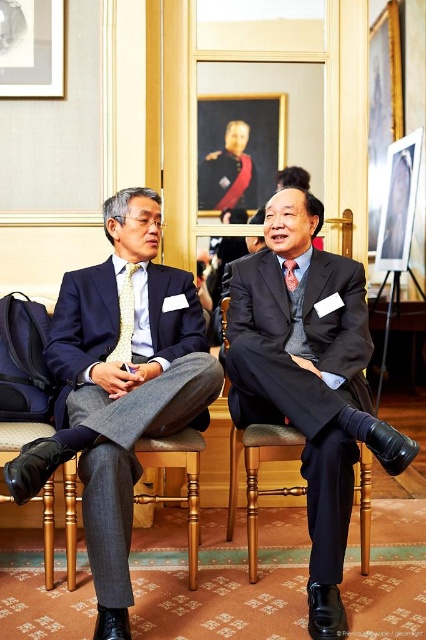
Based on the scene description, can you determine which object is taller between the wooden chair at center and the yellowtexturetie at center?

The wooden chair at center is taller than the yellowtexturetie at center according to the description.

You are an art curator planning to move the oil painting at upper center and the red silk tie at center to a new exhibition space. If you want to maintain their original spatial relationship, which object should be placed to the left of the other?

The oil painting at upper center should be placed to the left of the red silk tie at center to maintain their original spatial relationship.

You are standing in the room and want to move closer to the yellowtexturetie at center. Is the wooden chair at center blocking your path?

The wooden chair at center is closer to the viewer than the yellowtexturetie at center, so the wooden chair at center would block your path to the yellowtexturetie at center.